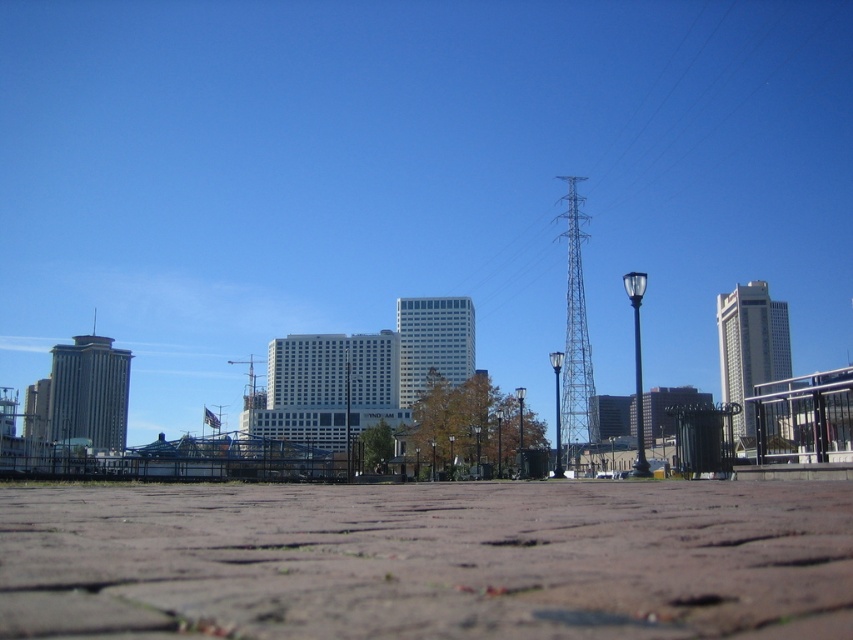
Which is in front, point (462, 60) or point (751, 308)?

Point (751, 308)

Can you confirm if metallic tower at upper center is positioned to the right of white glass skyscraper at right?

Correct, you'll find metallic tower at upper center to the right of white glass skyscraper at right.

Measure the distance between metallic tower at upper center and camera.

metallic tower at upper center and camera are 312.79 meters apart.

Locate an element on the screen. metallic tower at upper center is located at coordinates (651, 140).

Does metallic tower at upper center have a greater width compared to white glass building at center?

Yes.

Between point (502, 218) and point (463, 360), which one is positioned in front?

Point (463, 360)

Where is `metallic tower at upper center`? The width and height of the screenshot is (853, 640). metallic tower at upper center is located at coordinates (651, 140).

Measure the distance between white glass skyscraper at right and camera.

white glass skyscraper at right and camera are 18.55 meters apart.

At what (x,y) coordinates should I click in order to perform the action: click on white glass skyscraper at right. Please return your answer as a coordinate pair (x, y). Looking at the image, I should click on (750, 346).